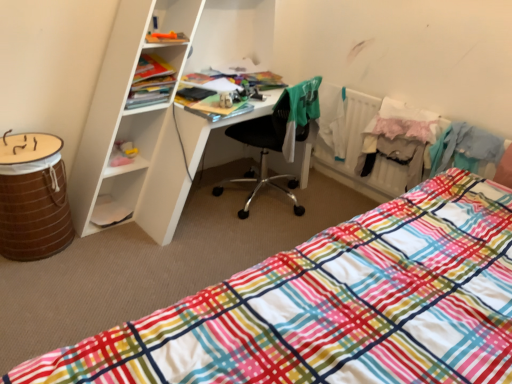
Identify the location of brown woven barrel at lower left. (34, 215).

What is the approximate width of black plastic chair at center?

black plastic chair at center is 21.32 inches wide.

Identify the location of green fabric shirt at center, which is the first clothing from left to right. Image resolution: width=512 pixels, height=384 pixels. (300, 111).

You are a GUI agent. You are given a task and a screenshot of the screen. Output one action in this format:
    pyautogui.click(x=<x>, y=<y>)
    Task: Click on the plaid fabric bed at lower right
    
    Given the screenshot: What is the action you would take?
    pyautogui.click(x=335, y=306)

Who is smaller, brown woven barrel at lower left or black plastic chair at center?

With smaller size is brown woven barrel at lower left.

Considering the relative sizes of brown woven barrel at lower left and black plastic chair at center in the image provided, is brown woven barrel at lower left thinner than black plastic chair at center?

Yes.

Is brown woven barrel at lower left aimed at black plastic chair at center?

No, brown woven barrel at lower left is not oriented towards black plastic chair at center.

Is plaid fabric bed at lower right inside the boundaries of matte plastic cabinet at upper left, or outside?

plaid fabric bed at lower right lies outside matte plastic cabinet at upper left.

Is plaid fabric bed at lower right further to camera compared to matte plastic cabinet at upper left?

No, plaid fabric bed at lower right is closer to the viewer.

Find the location of `cabinet behind the plaid fabric bed at lower right`. cabinet behind the plaid fabric bed at lower right is located at coordinates (152, 81).

Does point (337, 363) appear closer or farther from the camera than point (165, 100)?

Point (337, 363) is positioned closer to the camera compared to point (165, 100).

Is white lace skirt at right, the 1th clothing viewed from the right, not within black plastic chair at center?

Yes, white lace skirt at right, the 1th clothing viewed from the right, is located beyond the bounds of black plastic chair at center.

Is white lace skirt at right, the 1th clothing viewed from the right, placed right next to black plastic chair at center?

No, white lace skirt at right, the 1th clothing viewed from the right, is not in contact with black plastic chair at center.

Can you confirm if white lace skirt at right, acting as the 2th clothing starting from the left, is smaller than black plastic chair at center?

Indeed, white lace skirt at right, acting as the 2th clothing starting from the left, has a smaller size compared to black plastic chair at center.

Identify the location of clothing below the black plastic chair at center (from the image's perspective). This screenshot has width=512, height=384. (399, 138).

From the image's perspective, between black plastic chair at center and matte plastic cabinet at upper left, which one is located above?

From the image's view, matte plastic cabinet at upper left is above.

At what (x,y) coordinates should I click in order to perform the action: click on cabinet lying behind the black plastic chair at center. Please return your answer as a coordinate pair (x, y). Looking at the image, I should click on (152, 81).

Which of these two, black plastic chair at center or matte plastic cabinet at upper left, stands taller?

Standing taller between the two is black plastic chair at center.

Is point (165, 77) behind point (291, 119)?

Yes, point (165, 77) is farther from viewer.

Considering the relative positions of matte plastic cabinet at upper left and green fabric shirt at center, which is the first clothing from left to right, in the image provided, is matte plastic cabinet at upper left to the left or to the right of green fabric shirt at center, which is the first clothing from left to right,?

In the image, matte plastic cabinet at upper left appears on the left side of green fabric shirt at center, which is the first clothing from left to right.

Would you say matte plastic cabinet at upper left is outside green fabric shirt at center, which is the first clothing from left to right?

Yes, matte plastic cabinet at upper left is located beyond the bounds of green fabric shirt at center, which is the first clothing from left to right.

Which of these two, matte plastic cabinet at upper left or green fabric shirt at center, which is the first clothing from left to right, is smaller?

matte plastic cabinet at upper left is smaller.

Which object is further away from the camera, black plastic chair at center or green fabric shirt at center, which is counted as the 2th clothing, starting from the right?

green fabric shirt at center, which is counted as the 2th clothing, starting from the right, is further away from the camera.

Does point (241, 181) come behind point (287, 124)?

Yes.

From the image's perspective, which is below, black plastic chair at center or green fabric shirt at center, which is the first clothing from left to right?

black plastic chair at center appears lower in the image.

Considering the positions of objects black plastic chair at center and green fabric shirt at center, which is counted as the 2th clothing, starting from the right, in the image provided, who is more to the right, black plastic chair at center or green fabric shirt at center, which is counted as the 2th clothing, starting from the right,?

green fabric shirt at center, which is counted as the 2th clothing, starting from the right, is more to the right.

Is plaid fabric bed at lower right in front of brown woven barrel at lower left?

Yes, plaid fabric bed at lower right is closer to the camera.

Is brown woven barrel at lower left completely or partially inside plaid fabric bed at lower right?

That's incorrect, brown woven barrel at lower left is not inside plaid fabric bed at lower right.

This screenshot has width=512, height=384. Find the location of `barrel that appears above the plaid fabric bed at lower right (from the image's perspective)`. barrel that appears above the plaid fabric bed at lower right (from the image's perspective) is located at coordinates (34, 215).

Can you tell me how much plaid fabric bed at lower right and brown woven barrel at lower left differ in facing direction?

plaid fabric bed at lower right and brown woven barrel at lower left are facing 179 degrees away from each other.

Where is `chair behind the brown woven barrel at lower left`? chair behind the brown woven barrel at lower left is located at coordinates (276, 137).

The height and width of the screenshot is (384, 512). Identify the location of bed located underneath the matte plastic cabinet at upper left (from a real-world perspective). (335, 306).

When comparing their distances from black plastic chair at center, does matte plastic cabinet at upper left or green fabric shirt at center, which is counted as the 2th clothing, starting from the right, seem further?

matte plastic cabinet at upper left.

Based on their spatial positions, is matte plastic cabinet at upper left or plaid fabric bed at lower right closer to white lace skirt at right, acting as the 2th clothing starting from the left?

Among the two, plaid fabric bed at lower right is located nearer to white lace skirt at right, acting as the 2th clothing starting from the left.

When comparing their distances from plaid fabric bed at lower right, does brown woven barrel at lower left or green fabric shirt at center, which is counted as the 2th clothing, starting from the right, seem further?

brown woven barrel at lower left is further to plaid fabric bed at lower right.

Estimate the real-world distances between objects in this image. Which object is closer to plaid fabric bed at lower right, black plastic chair at center or brown woven barrel at lower left?

Among the two, black plastic chair at center is located nearer to plaid fabric bed at lower right.

Based on their spatial positions, is brown woven barrel at lower left or plaid fabric bed at lower right closer to matte plastic cabinet at upper left?

brown woven barrel at lower left.

When comparing their distances from green fabric shirt at center, which is counted as the 2th clothing, starting from the right, does black plastic chair at center or white lace skirt at right, the 1th clothing viewed from the right, seem further?

Among the two, white lace skirt at right, the 1th clothing viewed from the right, is located further to green fabric shirt at center, which is counted as the 2th clothing, starting from the right.

Considering their positions, is green fabric shirt at center, which is the first clothing from left to right, positioned closer to plaid fabric bed at lower right than black plastic chair at center?

Among the two, green fabric shirt at center, which is the first clothing from left to right, is located nearer to plaid fabric bed at lower right.

Looking at the image, which one is located closer to black plastic chair at center, plaid fabric bed at lower right or white lace skirt at right, the 1th clothing viewed from the right?

white lace skirt at right, the 1th clothing viewed from the right, is closer to black plastic chair at center.

Image resolution: width=512 pixels, height=384 pixels. What are the coordinates of `clothing between plaid fabric bed at lower right and white lace skirt at right, the 1th clothing viewed from the right, in the front-back direction` in the screenshot? It's located at (300, 111).

Locate an element on the screen. The image size is (512, 384). cabinet between brown woven barrel at lower left and green fabric shirt at center, which is the first clothing from left to right, in the horizontal direction is located at coordinates (152, 81).

Where is `bed between brown woven barrel at lower left and white lace skirt at right, acting as the 2th clothing starting from the left`? The height and width of the screenshot is (384, 512). bed between brown woven barrel at lower left and white lace skirt at right, acting as the 2th clothing starting from the left is located at coordinates (335, 306).

Where is `barrel between plaid fabric bed at lower right and matte plastic cabinet at upper left in the front-back direction`? The width and height of the screenshot is (512, 384). barrel between plaid fabric bed at lower right and matte plastic cabinet at upper left in the front-back direction is located at coordinates (34, 215).